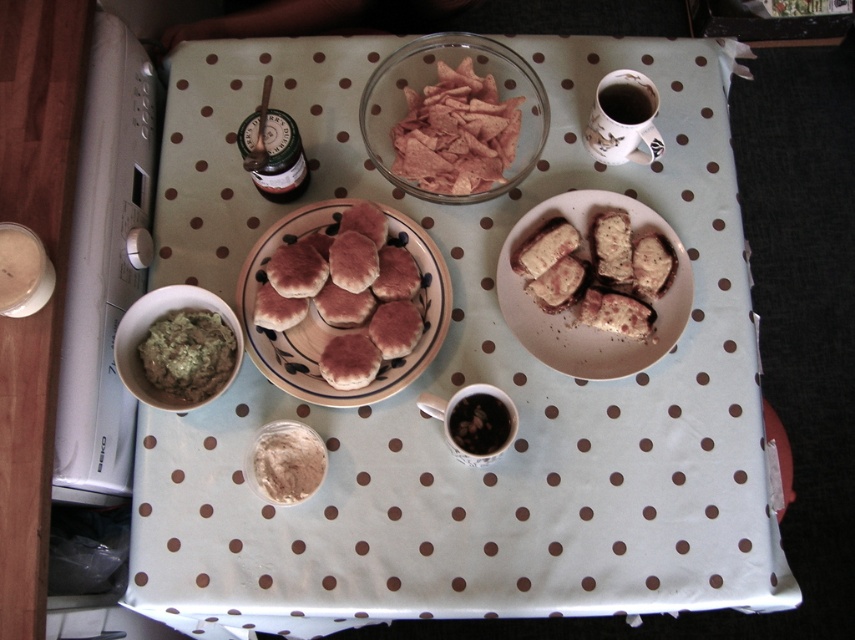
You are planning to place a small decorative item between the brown crumbly bread at center right and the powdery beige powder at center. Based on their positions, which object should you position closer to the edge of the table to ensure the item fits?

You should position the brown crumbly bread at center right closer to the edge of the table. Since it might be wider than the powdery beige powder at center, placing it closer to the edge would leave enough space for the decorative item between them.

You are setting up a small snack station for a gathering. You have a light blue fabric at center and another item. The distance between them is 32.85 inches. If you need to place a 12 inch wide tray between them, will there be enough space?

The light blue fabric at center and the other item are 32.85 inches apart. Since the tray is only 12 inches wide, there is sufficient space to place it between them as 32.85 inches is greater than 12 inches.

You are a guest at a party and you want to place a small plate on the table. The plate is 10 cm in diameter. Which object on the table, the light blue fabric at center or the powdery beige powder at center, would allow you to place the plate next to it without overlapping?

The light blue fabric at center has a greater width than the powdery beige powder at center, so placing the plate next to the light blue fabric at center would provide more space and prevent overlapping.